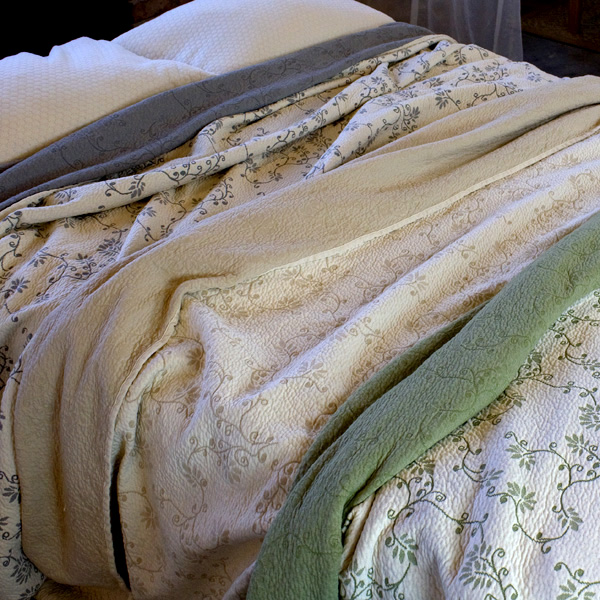
Locate an element on the screen. yellow blanket is located at coordinates (284, 242).